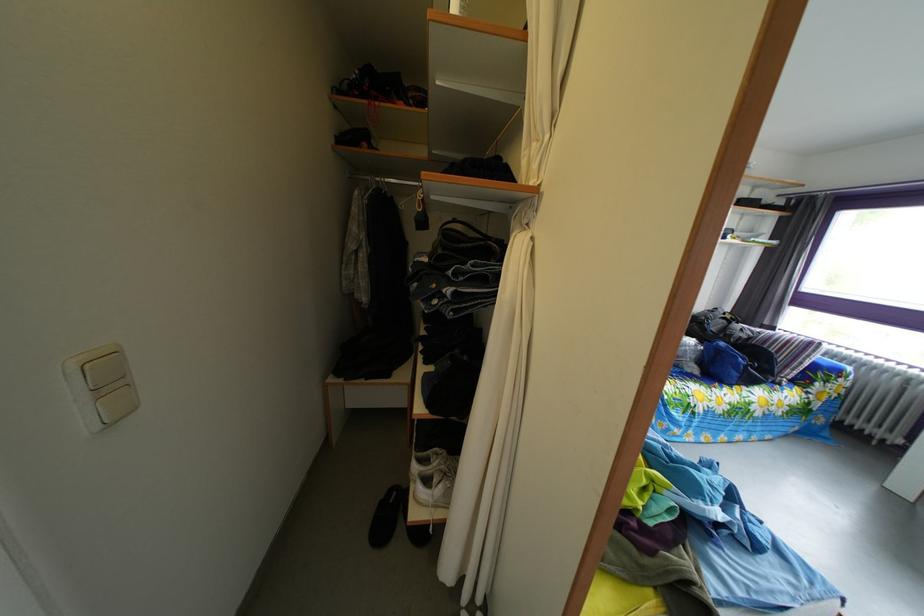
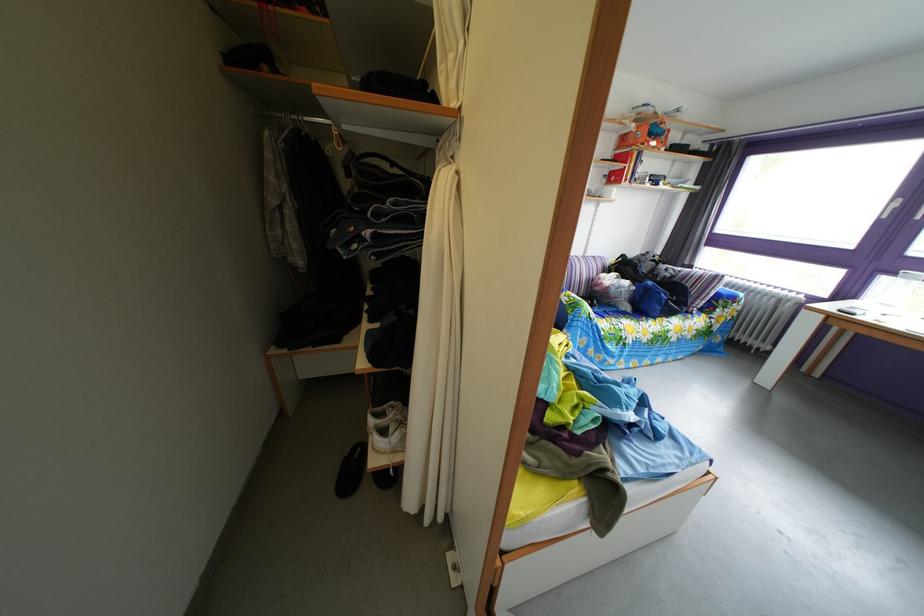
Locate, in the second image, the point that corresponds to the point at 388,188 in the first image.

(306, 126)